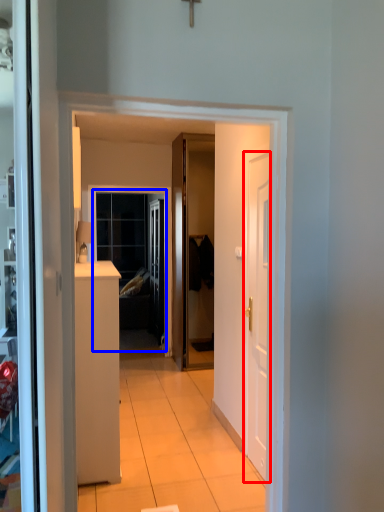
Question: Among these objects, which one is nearest to the camera, door (highlighted by a red box) or window (highlighted by a blue box)?

Choices:
 (A) door
 (B) window

Answer: (A)